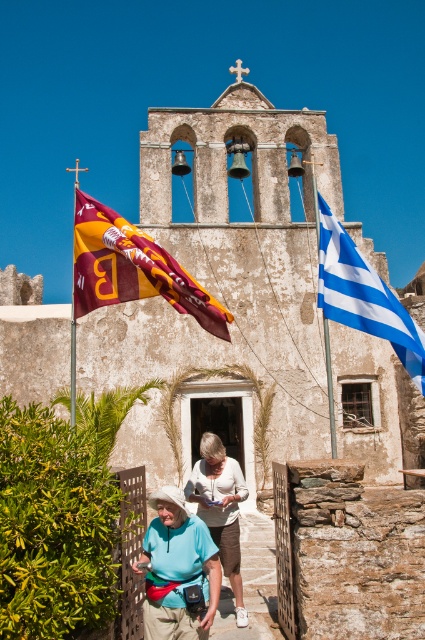
Does point (113, 266) come in front of point (229, 493)?

Yes, point (113, 266) is in front of point (229, 493).

Which of these two, maroon fabric flag at left or light blue fabric at center, stands shorter?

Standing shorter between the two is light blue fabric at center.

Is point (192, 296) positioned before point (218, 458)?

Yes.

You are a GUI agent. You are given a task and a screenshot of the screen. Output one action in this format:
    pyautogui.click(x=<x>, y=<y>)
    Task: Click on the maroon fabric flag at left
    Image resolution: width=425 pixels, height=640 pixels.
    Given the screenshot: What is the action you would take?
    pyautogui.click(x=132, y=268)

Can you confirm if maroon fabric flag at left is wider than blue/white striped flag at right?

Indeed, maroon fabric flag at left has a greater width compared to blue/white striped flag at right.

Is maroon fabric flag at left to the left of blue/white striped flag at right from the viewer's perspective?

Yes, maroon fabric flag at left is to the left of blue/white striped flag at right.

Between point (107, 259) and point (370, 282), which one is positioned in front?

Point (370, 282) is in front.

This screenshot has height=640, width=425. Find the location of `maroon fabric flag at left`. maroon fabric flag at left is located at coordinates (132, 268).

Is light blue fabric at center to the left of blue/white striped flag at right from the viewer's perspective?

Yes, light blue fabric at center is to the left of blue/white striped flag at right.

Who is lower down, light blue fabric at center or blue/white striped flag at right?

light blue fabric at center is below.

Measure the distance between point (192, 481) and camera.

149.58 feet

This screenshot has height=640, width=425. What are the coordinates of `light blue fabric at center` in the screenshot? It's located at (218, 520).